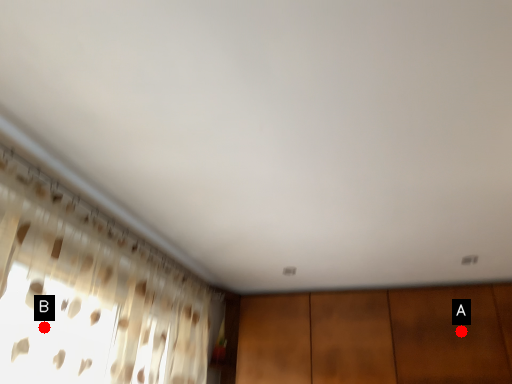
Question: Two points are circled on the image, labeled by A and B beside each circle. Which point is further to the camera?

Choices:
 (A) A is further
 (B) B is further

Answer: (A)